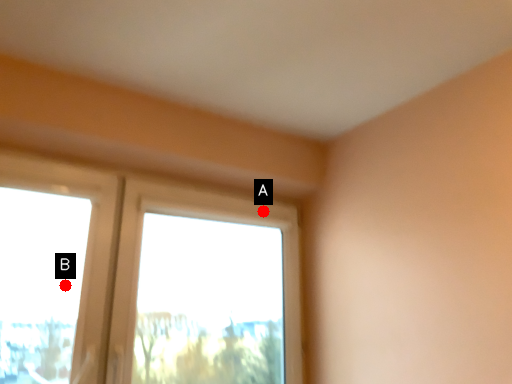
Question: Two points are circled on the image, labeled by A and B beside each circle. Which of the following is the farthest from the observer?

Choices:
 (A) A is further
 (B) B is further

Answer: (A)